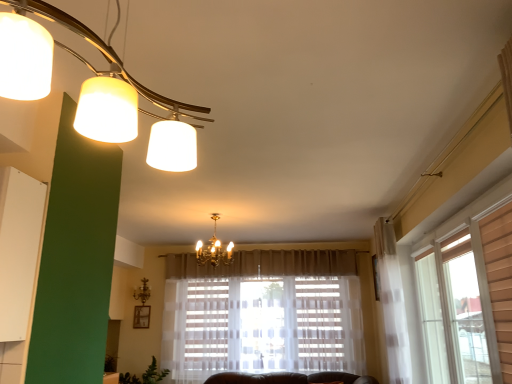
Question: Is white matte lampshade at upper left, which is the 1th lamp in front-to-back order, looking in the opposite direction of gold metallic chandelier at center, the second lamp when ordered from left to right?

Choices:
 (A) no
 (B) yes

Answer: (A)

Question: Is white matte lampshade at upper left, the third lamp positioned from the back, aimed at gold metallic chandelier at center, acting as the 2th lamp starting from the top?

Choices:
 (A) yes
 (B) no

Answer: (B)

Question: From a real-world perspective, is white matte lampshade at upper left, which ranks as the third lamp in bottom-to-top order, positioned under gold metallic chandelier at center, the second lamp ordered from the bottom, based on gravity?

Choices:
 (A) yes
 (B) no

Answer: (A)

Question: Is white matte lampshade at upper left, which ranks as the third lamp in bottom-to-top order, smaller than gold metallic chandelier at center, the second lamp ordered from the bottom?

Choices:
 (A) yes
 (B) no

Answer: (B)

Question: Are white matte lampshade at upper left, placed as the third lamp when sorted from left to right, and gold metallic chandelier at center, acting as the 2th lamp starting from the top, far apart?

Choices:
 (A) no
 (B) yes

Answer: (B)

Question: In terms of width, does gold metallic chandelier at center, arranged as the first lamp when viewed from the left, look wider or thinner when compared to gold metallic chandelier at center, marked as the 2th lamp in a back-to-front arrangement?

Choices:
 (A) thin
 (B) wide

Answer: (A)

Question: In terms of size, does gold metallic chandelier at center, arranged as the first lamp when viewed from the left, appear bigger or smaller than gold metallic chandelier at center, the second lamp ordered from the bottom?

Choices:
 (A) small
 (B) big

Answer: (A)

Question: Visually, is gold metallic chandelier at center, arranged as the 3th lamp when viewed from the front, positioned to the left or to the right of gold metallic chandelier at center, placed as the 2th lamp when sorted from right to left?

Choices:
 (A) right
 (B) left

Answer: (B)

Question: Relative to gold metallic chandelier at center, placed as the 2th lamp when sorted from right to left, is gold metallic chandelier at center, the 1th lamp when ordered from back to front, in front or behind?

Choices:
 (A) behind
 (B) front

Answer: (A)

Question: In terms of size, does gold metallic chandelier at center, the second lamp when ordered from left to right, appear bigger or smaller than gold metallic chandelier at center, the third lamp from the top?

Choices:
 (A) small
 (B) big

Answer: (B)

Question: Is gold metallic chandelier at center, the second lamp when ordered from left to right, taller or shorter than gold metallic chandelier at center, the 1th lamp when ordered from back to front?

Choices:
 (A) short
 (B) tall

Answer: (B)

Question: Would you say gold metallic chandelier at center, marked as the 2th lamp in a back-to-front arrangement, is to the left or to the right of gold metallic chandelier at center, which is the first lamp in bottom-to-top order, in the picture?

Choices:
 (A) left
 (B) right

Answer: (B)

Question: Is point (225, 248) positioned closer to the camera than point (134, 294)?

Choices:
 (A) closer
 (B) farther

Answer: (A)

Question: Considering the positions of gold metallic chandelier at center, the third lamp from the top, and white matte lampshade at upper left, positioned as the 1th lamp in top-to-bottom order, in the image, is gold metallic chandelier at center, the third lamp from the top, taller or shorter than white matte lampshade at upper left, positioned as the 1th lamp in top-to-bottom order,?

Choices:
 (A) tall
 (B) short

Answer: (B)

Question: From a real-world perspective, is gold metallic chandelier at center, arranged as the first lamp when viewed from the left, above or below white matte lampshade at upper left, which ranks as the third lamp in bottom-to-top order?

Choices:
 (A) above
 (B) below

Answer: (B)